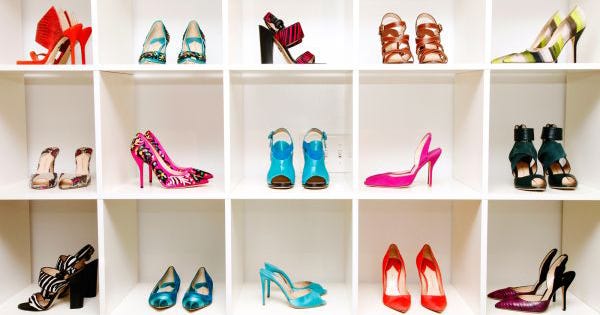
At what (x,y) coordinates should I click in order to perform the action: click on shoes on top shelf. Please return your answer as a coordinate pair (x, y). This screenshot has height=315, width=600. Looking at the image, I should click on (50, 35), (85, 35), (156, 45), (195, 51), (285, 37), (397, 45), (422, 39), (559, 38), (546, 36).